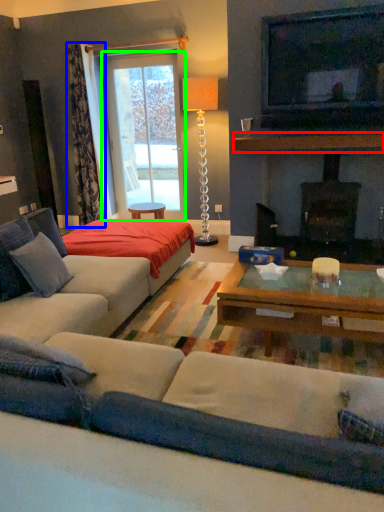
Question: Which is nearer to the mantle (highlighted by a red box)? curtain (highlighted by a blue box) or window screen (highlighted by a green box).

Choices:
 (A) curtain
 (B) window screen

Answer: (B)